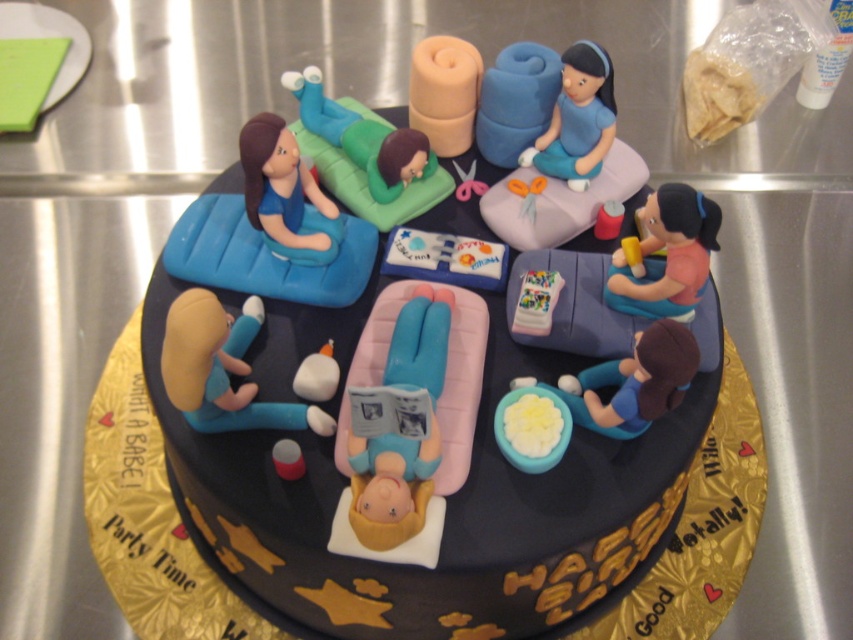
You are a guest at the birthday party and want to know if the blue glossy bowl at lower right can hold the matte blue figure at upper left. Based on their sizes, what do you think?

The blue glossy bowl at lower right is bigger than the matte blue figure at upper left, so it can hold the matte blue figure at upper left inside it.

You are a cake decorator who needs to place a new decoration between the matte pink foam at center and the blue glossy bowl at lower right. The decoration is 10 centimeters wide. Will it fit in the space between them?

The distance between the matte pink foam at center and the blue glossy bowl at lower right is 12.21 centimeters. Since the decoration is 10 centimeters wide, it will fit in the space between them.

You are a guest at the birthday party and want to take a photo of the cake. You notice the blue glossy bowl at lower right and the matte blue figure at upper left. Which object should you focus on first if you want to capture both in your photo without moving the camera?

The blue glossy bowl at lower right is located below the matte blue figure at upper left. To capture both without moving the camera, focus on the matte blue figure at upper left first since it is higher up, ensuring the blue glossy bowl at lower right will also be in frame.